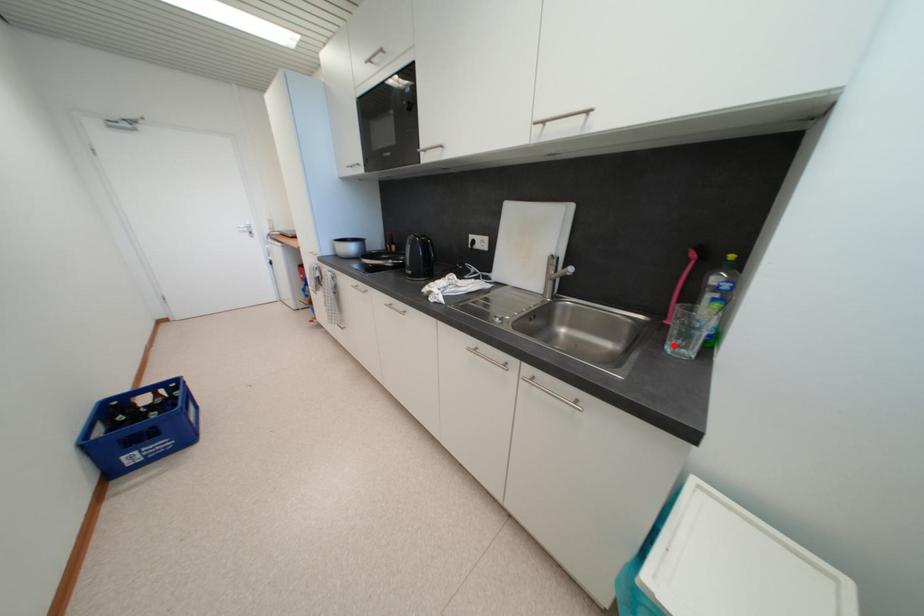
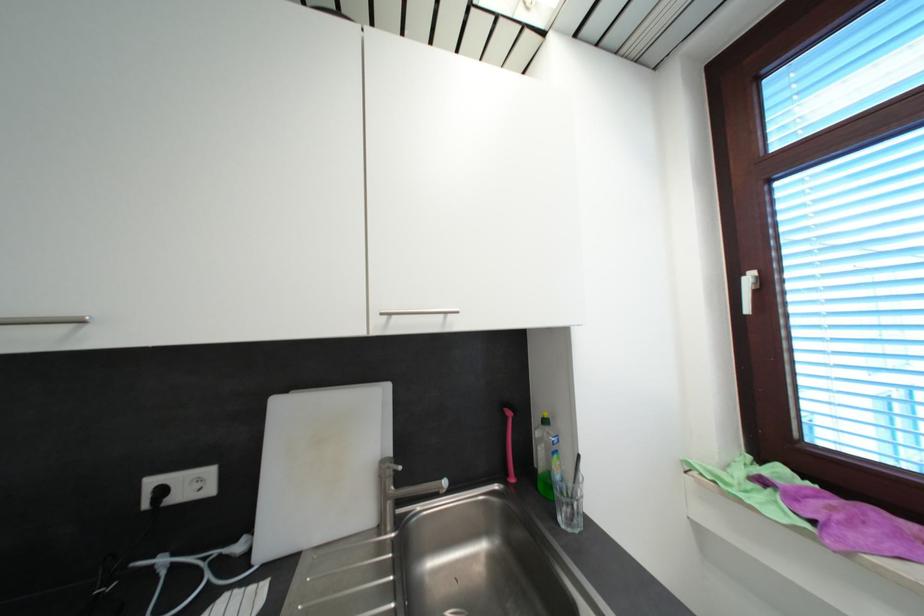
Find the pixel in the second image that matches the highlighted location in the first image.

(565, 522)